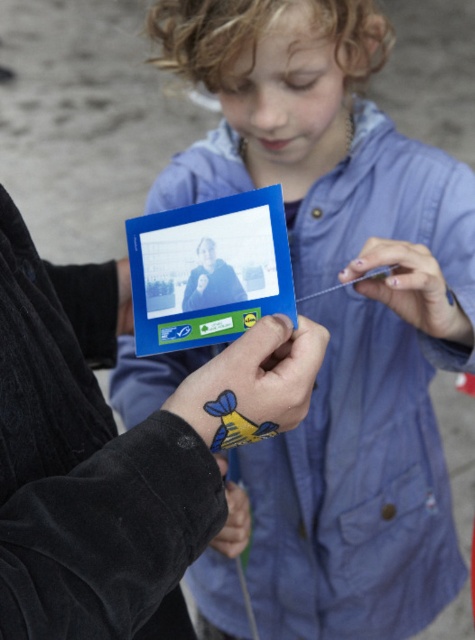
You are holding a blue plastic card at center and a matte plastic photo frame at center. Which object is taller?

The blue plastic card at center is much taller than the matte plastic photo frame at center.

You are a photographer trying to focus on the two points in the image. Which point, point (224, 266) or point (129, 330), is closer to your camera lens?

Point (224, 266) is closer to the camera lens than point (129, 330).

You are a delivery person who needs to hand over two items to a client. You are holding a matte plastic photo frame at center and a matte blue card at center. According to the scene, which item should you present first to ensure proper delivery sequence?

The matte blue card at center should be presented first since the matte plastic photo frame at center is to the right of it, meaning the blue card is on the left side and closer to the client.